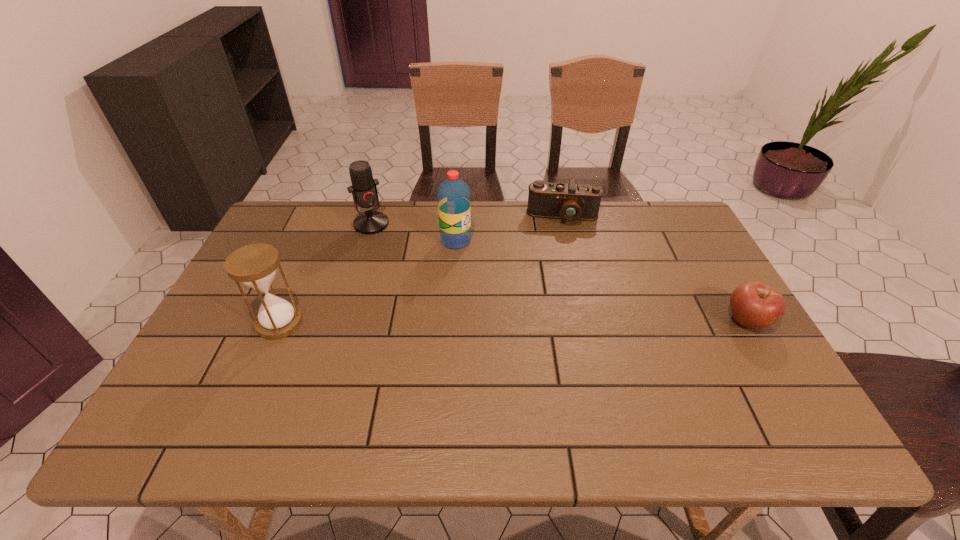
The image size is (960, 540). I want to click on vacant space located 0.330m on the front label of the third object from left to right, so click(545, 306).

Locate an element on the screen. free space located 0.370m on the side of the microphone with the red ring is located at coordinates tap(432, 303).

This screenshot has height=540, width=960. In order to click on vacant area situated 0.240m on the side of the microphone with the red ring in this screenshot , I will do `click(411, 276)`.

The height and width of the screenshot is (540, 960). Identify the location of free space located on the side of the microphone with the red ring. (393, 252).

Where is `free space located on the lens of the camera`? free space located on the lens of the camera is located at coordinates (562, 249).

Find the location of `vacant area located 0.240m on the lens of the camera`. vacant area located 0.240m on the lens of the camera is located at coordinates (563, 278).

Locate an element on the screen. free space located on the lens of the camera is located at coordinates (562, 247).

In order to click on water bottle that is at the far edge in this screenshot , I will do (453, 195).

This screenshot has width=960, height=540. In order to click on microphone situated at the far edge in this screenshot , I will do `click(364, 191)`.

Where is `camera present at the far edge`? The image size is (960, 540). camera present at the far edge is located at coordinates (570, 202).